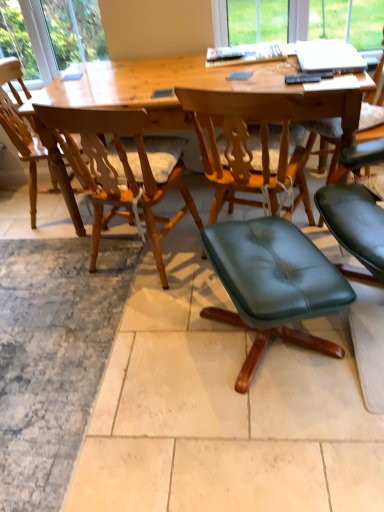
Question: Would you say green leather ottoman at lower right, the 3th chair when ordered from left to right, is to the left or to the right of light wood chair at center, which is the 1th chair from left to right, in the picture?

Choices:
 (A) right
 (B) left

Answer: (A)

Question: Is green leather ottoman at lower right, the 3th chair when ordered from left to right, in front of or behind light wood chair at center, the 4th chair from the right, in the image?

Choices:
 (A) behind
 (B) front

Answer: (B)

Question: Estimate the real-world distances between objects in this image. Which object is farther from the wooden chair at center, which is the second chair from left to right?

Choices:
 (A) light wood chair at center, the 4th chair from the right
 (B) green leather ottoman at lower right, marked as the 2th chair in a right-to-left arrangement
 (C) wooden desk at center
 (D) green leather ottoman at center, placed as the 4th chair when sorted from left to right

Answer: (A)

Question: Which object is the farthest from the green leather ottoman at center, placed as the 1th chair when sorted from right to left?

Choices:
 (A) light wood chair at center, the 4th chair from the right
 (B) green leather ottoman at lower right, marked as the 2th chair in a right-to-left arrangement
 (C) wooden chair at center, acting as the 3th chair starting from the right
 (D) wooden desk at center

Answer: (A)